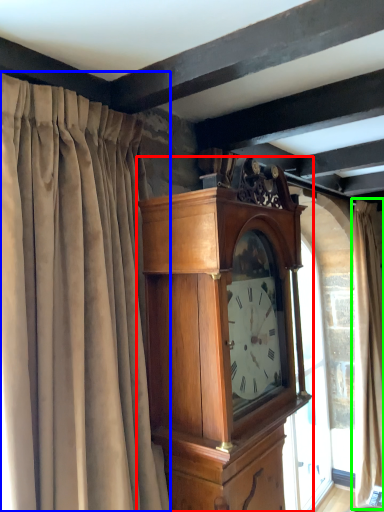
Question: Considering the real-world distances, which object is closest to wall clock (highlighted by a red box)? curtain (highlighted by a blue box) or curtain (highlighted by a green box).

Choices:
 (A) curtain
 (B) curtain

Answer: (A)